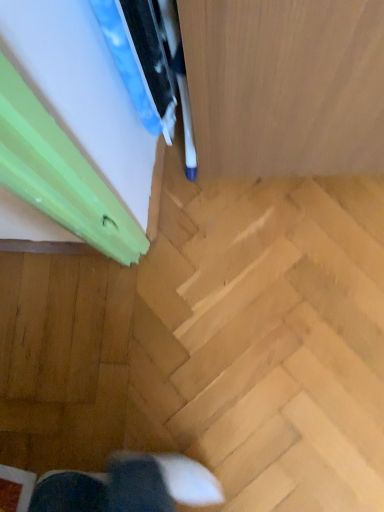
You are a GUI agent. You are given a task and a screenshot of the screen. Output one action in this format:
    pyautogui.click(x=<x>, y=<y>)
    Task: Click on the free space above wooden stairs at center (from a real-world perspective)
    
    Given the screenshot: What is the action you would take?
    pyautogui.click(x=254, y=308)